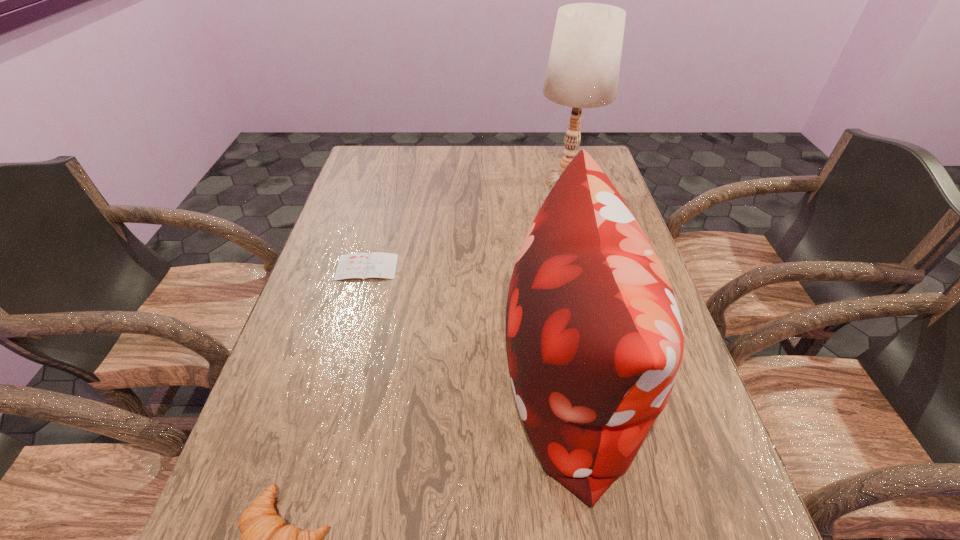
This screenshot has height=540, width=960. What are the coordinates of `free space between the farthest object and the third nearest object` in the screenshot? It's located at (467, 224).

Where is `empty space that is in between the second farthest object and the cushion`? The image size is (960, 540). empty space that is in between the second farthest object and the cushion is located at coordinates (468, 327).

The height and width of the screenshot is (540, 960). What are the coordinates of `free space between the third nearest object and the third shortest object` in the screenshot? It's located at (468, 327).

You are a GUI agent. You are given a task and a screenshot of the screen. Output one action in this format:
    pyautogui.click(x=<x>, y=<y>)
    Task: Click on the third closest object to the second farthest object
    The image size is (960, 540).
    Given the screenshot: What is the action you would take?
    pyautogui.click(x=266, y=539)

Identify the location of the third closest object relative to the third tallest object. (583, 69).

Locate an element on the screen. The image size is (960, 540). vacant area in the image that satisfies the following two spatial constraints: 1. on the back side of the tallest object; 2. on the left side of the shortest object is located at coordinates [391, 180].